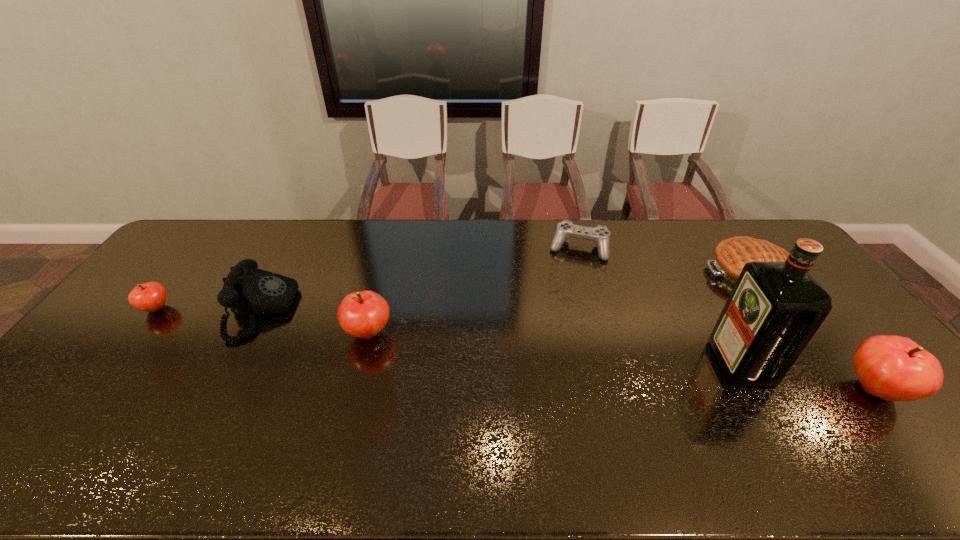
This screenshot has height=540, width=960. Find the location of `control that is at the far edge`. control that is at the far edge is located at coordinates [600, 235].

Where is `pie present at the far edge`? pie present at the far edge is located at coordinates (731, 254).

Where is `object that is at the near edge`? The height and width of the screenshot is (540, 960). object that is at the near edge is located at coordinates (894, 368).

Where is `object at the left edge`? object at the left edge is located at coordinates (151, 296).

At what (x,y) coordinates should I click in order to perform the action: click on apple at the right edge. Please return your answer as a coordinate pair (x, y). The width and height of the screenshot is (960, 540). Looking at the image, I should click on (894, 368).

Find the location of a particular element. pie that is at the right edge is located at coordinates (731, 254).

Find the location of `object located at the far right corner`. object located at the far right corner is located at coordinates (731, 254).

I want to click on object present at the near right corner, so click(894, 368).

This screenshot has height=540, width=960. In order to click on vacant region at the far edge of the desktop in this screenshot , I will do [x=613, y=256].

Where is `vacant area at the near edge`? The width and height of the screenshot is (960, 540). vacant area at the near edge is located at coordinates (310, 404).